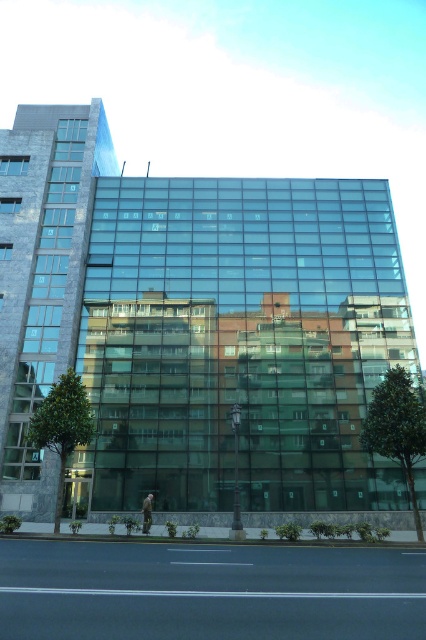
You are standing in front of the modern building and want to take a photo of the green leafy tree at center. If your camera has a maximum focus range of 60 feet, will you be able to capture the tree clearly?

The green leafy tree at center is 64.99 feet away from viewer, which exceeds the camera maximum focus range of 60 feet. Therefore, the camera cannot focus on the tree clearly.

You are standing in front of the modern building and notice two green leafy trees. One is labeled as the green leafy tree at center and the other as the green leafy tree at lower left. Which tree is positioned lower in the image?

The green leafy tree at center is positioned lower than the green leafy tree at lower left in the image.

You are standing in front of the modern building and notice a point at coordinates (397, 428). What object does this point correspond to?

The point at coordinates (397, 428) corresponds to the green leafy tree at center.